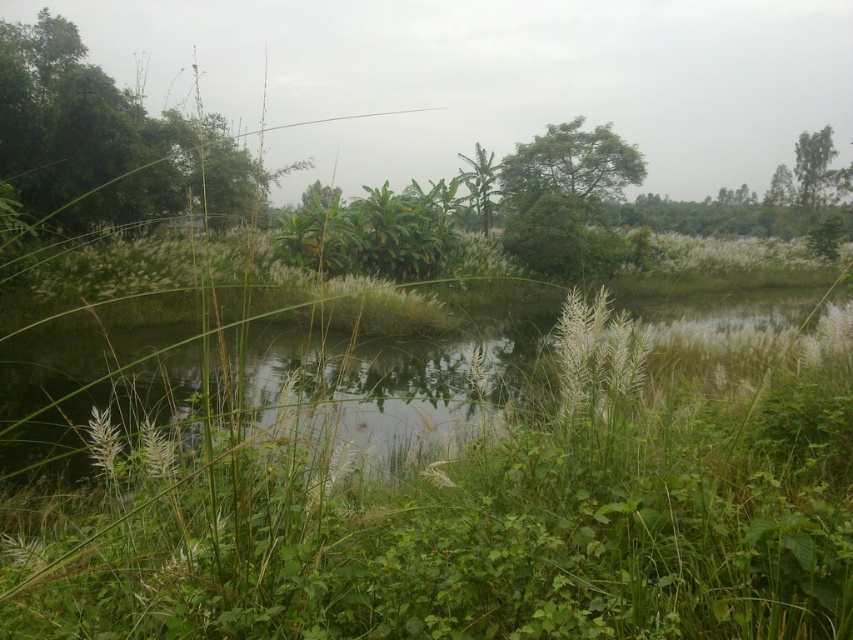
You are a hiker who wants to cross the pond. You have a 60 feet long rope. The green leafy tree at left and green leafy tree at center are on opposite sides of the pond. Can you use the rope to cross the pond?

The distance between the green leafy tree at left and green leafy tree at center is 61.41 feet. Since the rope is only 60 feet long, it is not long enough to span the gap between the green leafy tree at left and green leafy tree at center. Therefore, you cannot use the rope to cross the pond.